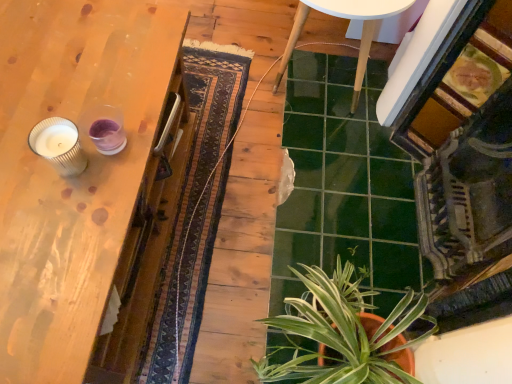
Locate an element on the screen. Image resolution: width=512 pixels, height=384 pixels. vacant region to the left of ridged glass candle at left is located at coordinates (18, 140).